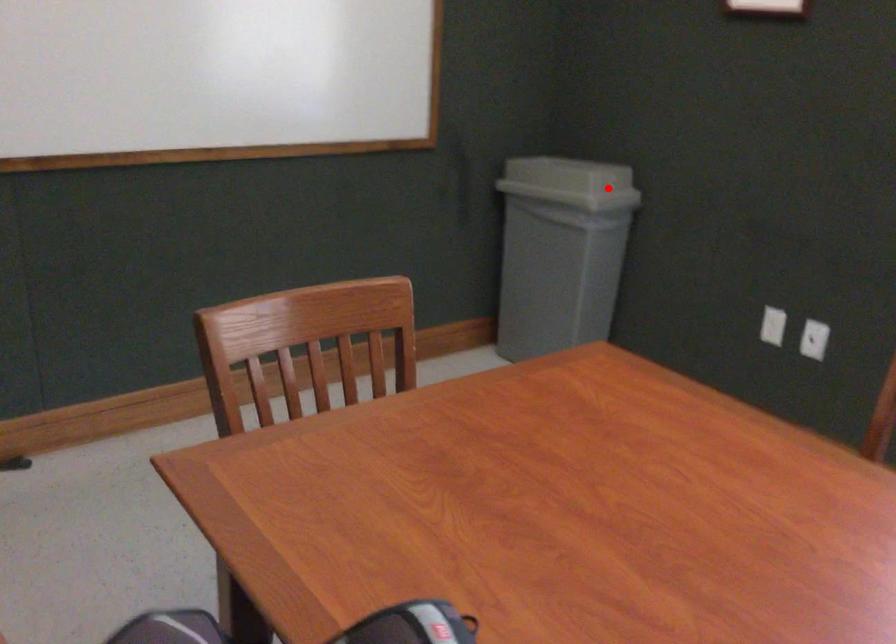
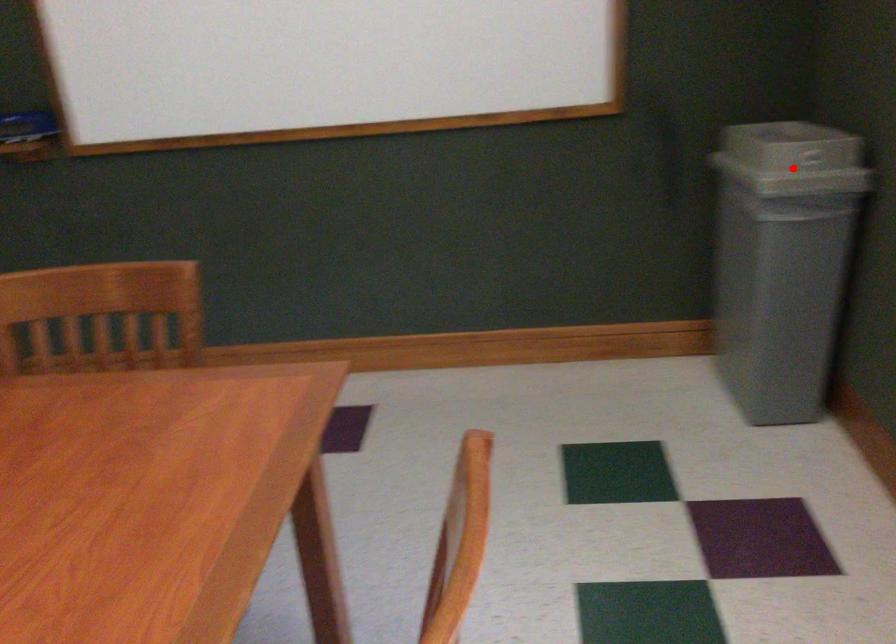
I am providing you with two images of the same scene from different viewpoints. A red point is marked on the first image and another point is marked on the second image. Is the red point in image1 aligned with the point shown in image2?

Yes